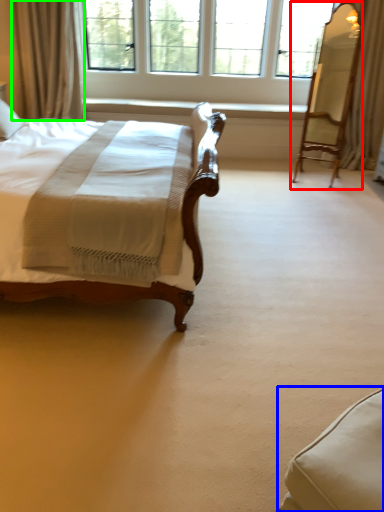
Question: Based on their relative distances, which object is farther from swivel chair (highlighted by a red box)? Choose from swivel chair (highlighted by a blue box) and curtain (highlighted by a green box).

Choices:
 (A) swivel chair
 (B) curtain

Answer: (A)